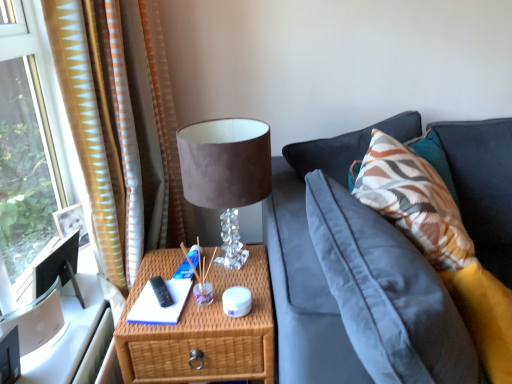
This screenshot has width=512, height=384. I want to click on empty space that is ontop of woven wood nightstand at lower center, so click(177, 288).